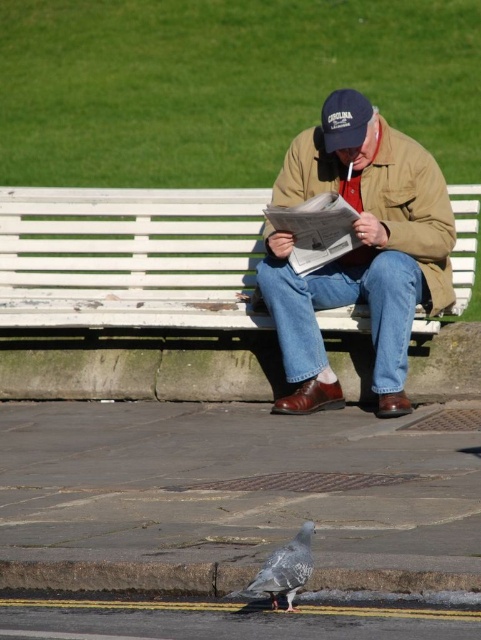
What do you see at coordinates (358, 250) in the screenshot? I see `tan leather jacket at center` at bounding box center [358, 250].

Looking at this image, is tan leather jacket at center above speckled gray pigeon at lower center?

Yes.

Between point (405, 369) and point (296, 588), which one is positioned in front?

Point (296, 588) is in front.

The image size is (481, 640). I want to click on tan leather jacket at center, so click(358, 250).

Who is positioned more to the right, white wooden bench at center or speckled gray pigeon at lower center?

speckled gray pigeon at lower center is more to the right.

Is white wooden bench at center behind speckled gray pigeon at lower center?

Yes, white wooden bench at center is behind speckled gray pigeon at lower center.

Describe the element at coordinates (127, 257) in the screenshot. The height and width of the screenshot is (640, 481). I see `white wooden bench at center` at that location.

At what (x,y) coordinates should I click in order to perform the action: click on white wooden bench at center. Please return your answer as a coordinate pair (x, y). The width and height of the screenshot is (481, 640). Looking at the image, I should click on (127, 257).

Does point (414, 288) come farther from viewer compared to point (358, 92)?

No, (414, 288) is in front of (358, 92).

Locate an element on the screen. The image size is (481, 640). tan leather jacket at center is located at coordinates (358, 250).